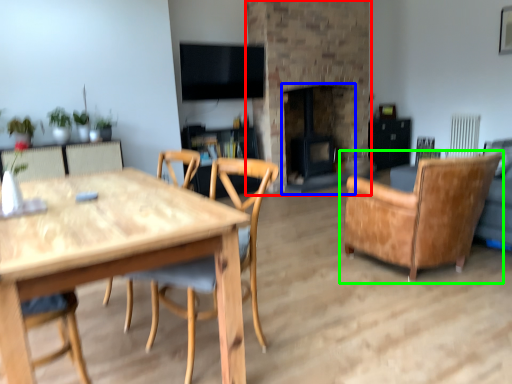
Question: Which object is the farthest from fireplace (highlighted by a red box)? Choose among these: fireplace (highlighted by a blue box) or chair (highlighted by a green box).

Choices:
 (A) fireplace
 (B) chair

Answer: (B)